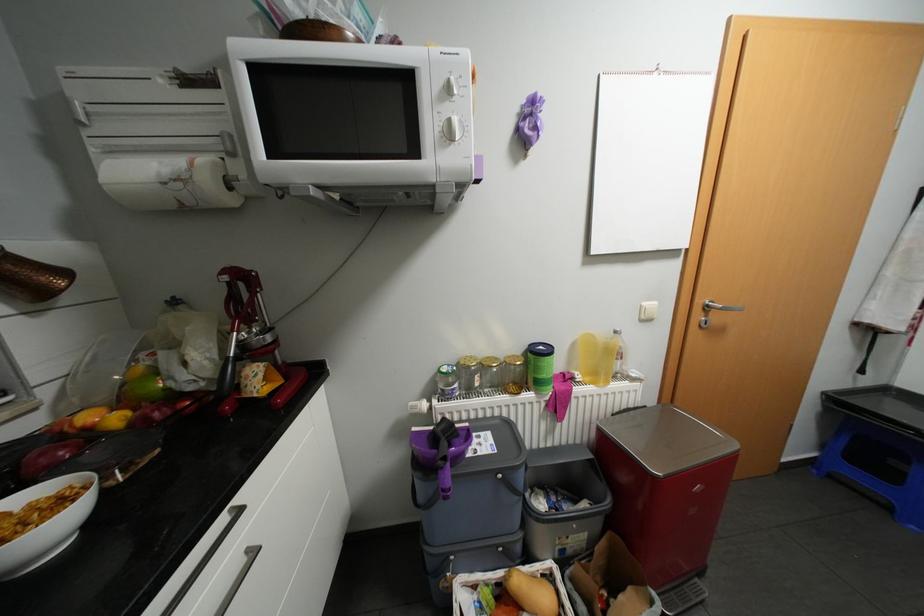
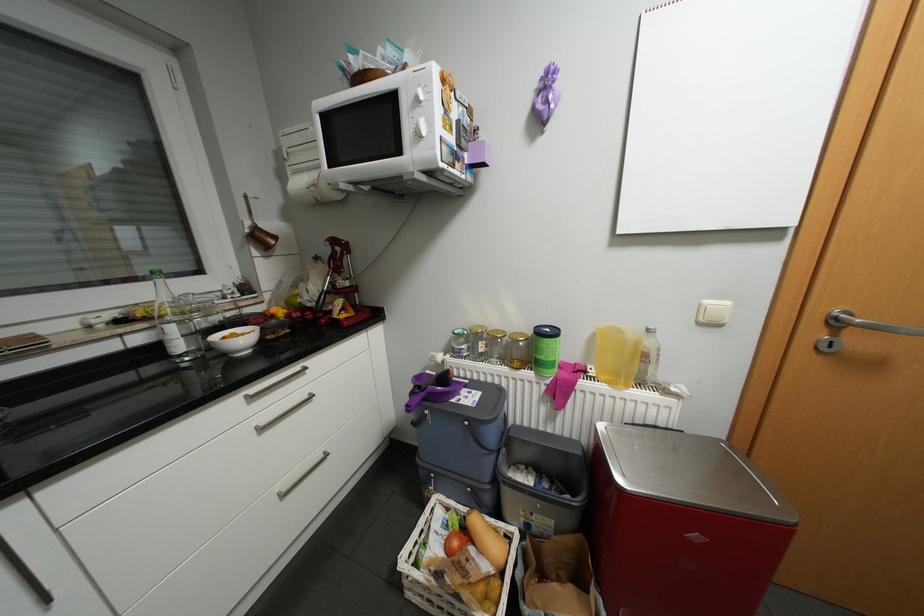
Locate, in the second image, the point that corresponds to point 464,384 in the first image.

(471, 345)